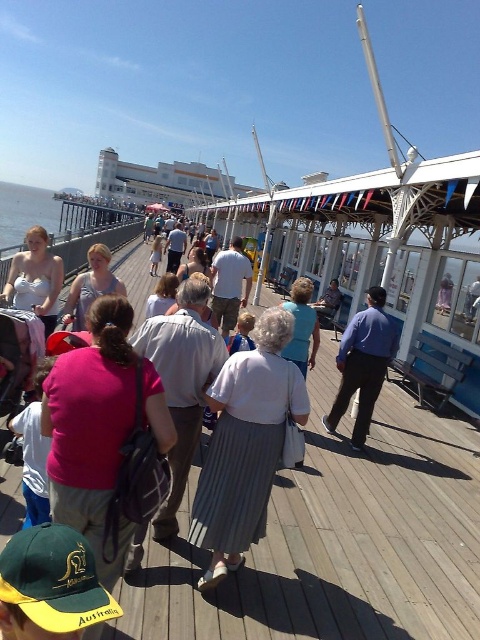
You are standing on the pier and want to take a photo of the clear blue water at pier left. Where should you position yourself to capture it in the frame?

Position yourself near the railing on the right side of the pier, opposite the clear blue water at pier left, to ensure it is centered in your photo.

You are a photographer taking a portrait of someone wearing a light gray pleated skirt at center and a matte white tank top at center. Which piece of clothing is visible higher up on the person?

The matte white tank top at center is visible higher up because the light gray pleated skirt at center is positioned under it.